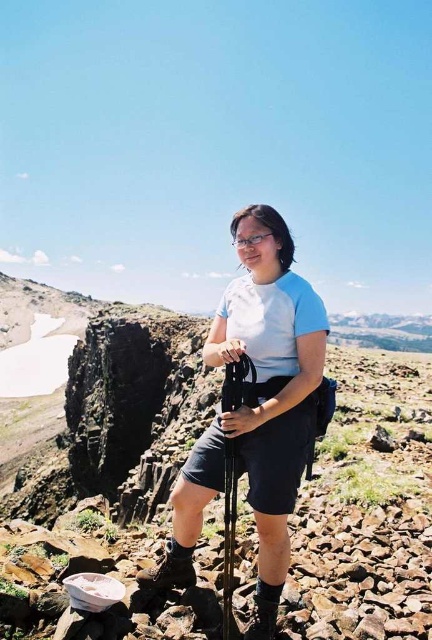
Does blue fabric shirt at center come behind black matte ski pole at center?

Yes, blue fabric shirt at center is behind black matte ski pole at center.

Which is behind, point (222, 353) or point (232, 545)?

Point (222, 353)

Between point (278, 323) and point (235, 483), which one is positioned behind?

The point (278, 323) is more distant.

Where is `blue fabric shirt at center`? The height and width of the screenshot is (640, 432). blue fabric shirt at center is located at coordinates (256, 408).